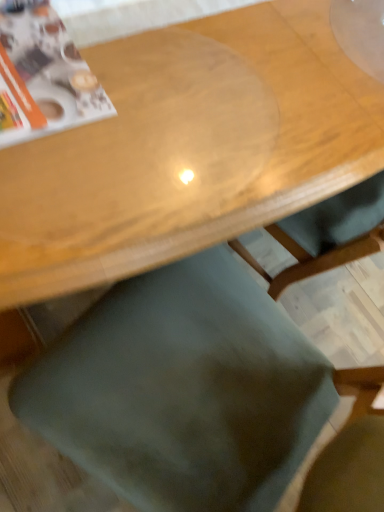
What are the coordinates of `free location to the right of matte paper magazine at upper left` in the screenshot? It's located at (159, 149).